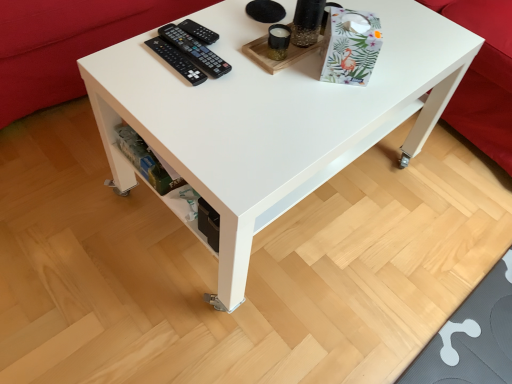
At what (x,y) coordinates should I click in order to perform the action: click on vacant space situated on the left part of black plastic remote at upper center, positioned as the 1th control in top-to-bottom order. Please return your answer as a coordinate pair (x, y). This screenshot has height=384, width=512. Looking at the image, I should click on (152, 39).